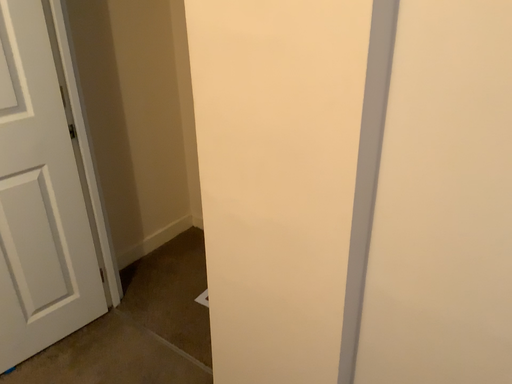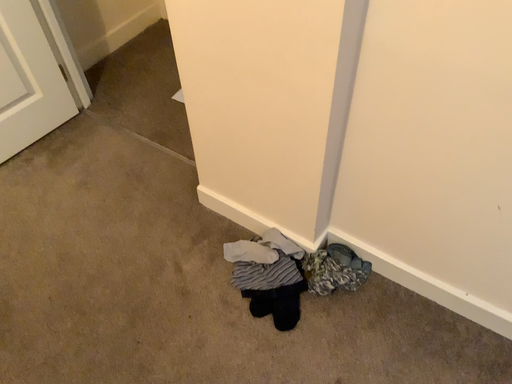
Question: How did the camera likely rotate when shooting the video?

Choices:
 (A) rotated downward
 (B) rotated upward

Answer: (A)